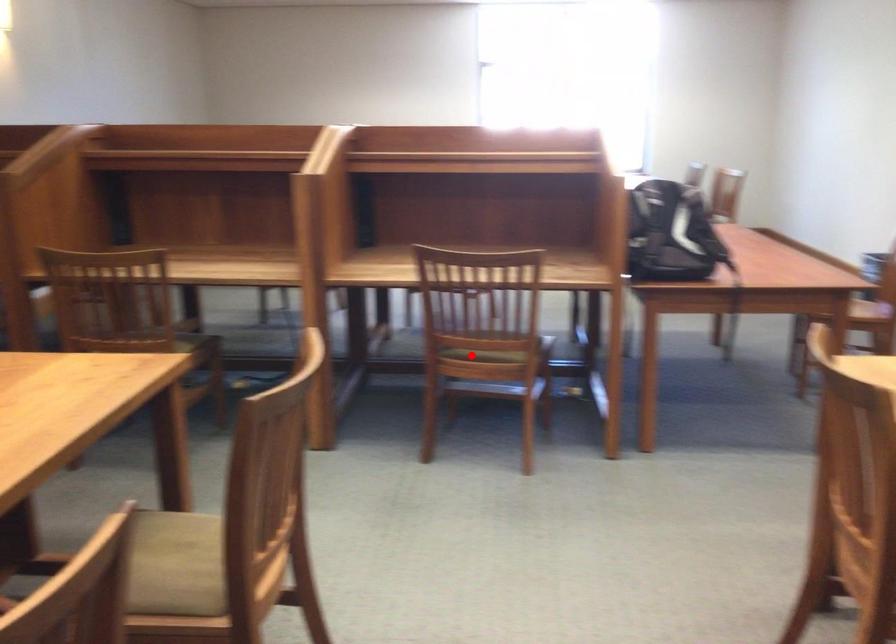
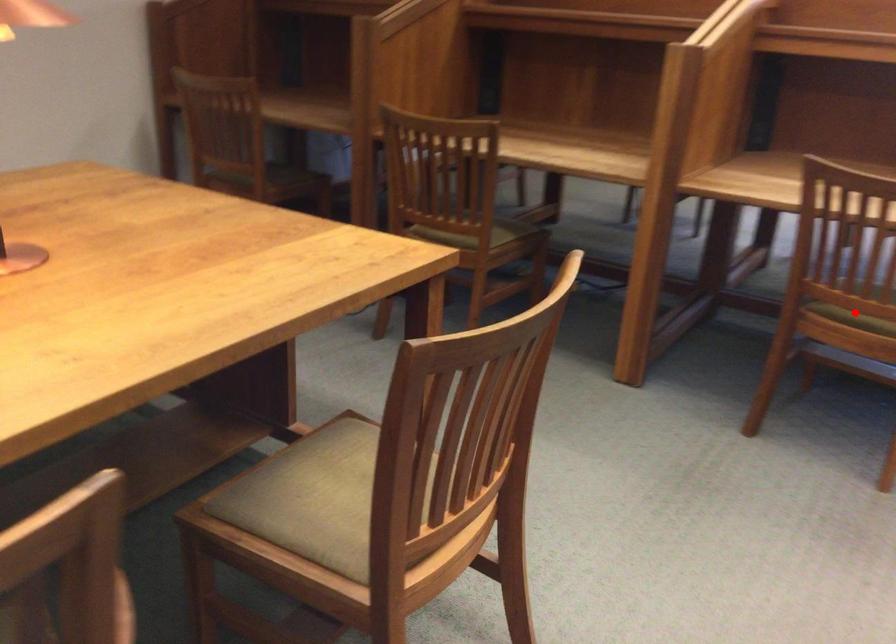
I am providing you with two images of the same scene from different viewpoints. A red point is marked on the first image and another point is marked on the second image. Do the highlighted points in image1 and image2 indicate the same real-world spot?

Yes